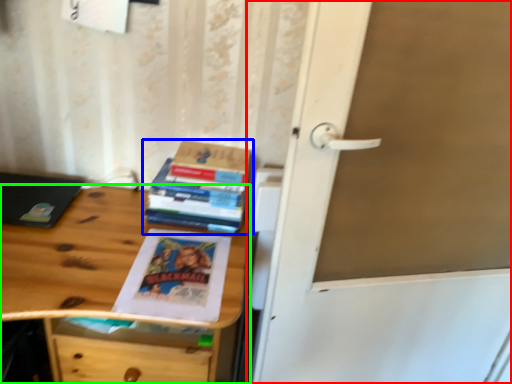
Question: Which object is positioned farthest from door (highlighted by a red box)? Select from book (highlighted by a blue box) and desk (highlighted by a green box).

Choices:
 (A) book
 (B) desk

Answer: (B)